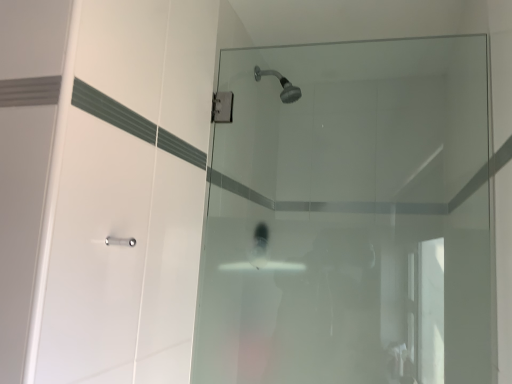
Question: Should I look upward or downward to see transparent glass shower door at center?

Choices:
 (A) up
 (B) down

Answer: (B)